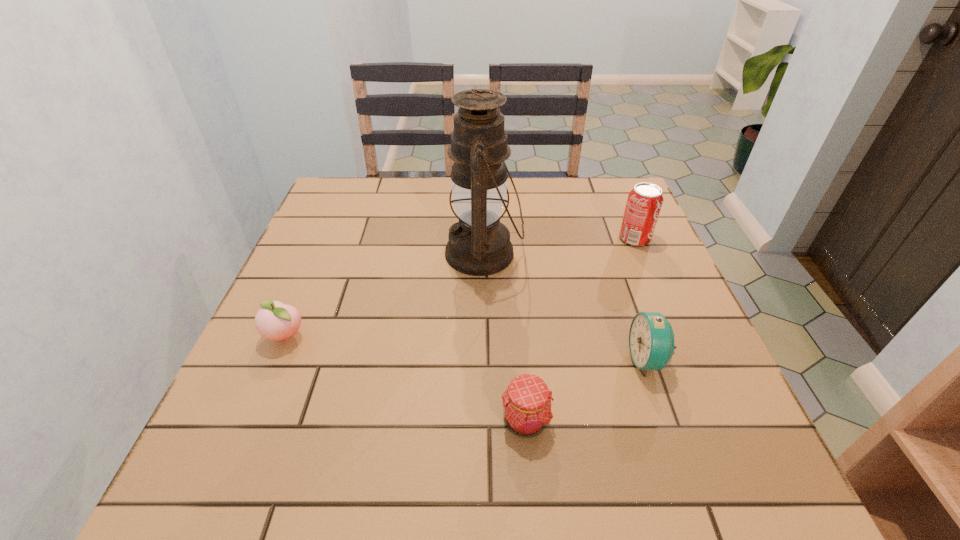
Where is `vacant area situated 0.260m on the front-facing side of the third tallest object`? This screenshot has height=540, width=960. vacant area situated 0.260m on the front-facing side of the third tallest object is located at coordinates (499, 360).

Locate an element on the screen. blank space located 0.060m on the front-facing side of the third tallest object is located at coordinates (600, 360).

Where is `blank space located 0.400m on the right of the peach`? blank space located 0.400m on the right of the peach is located at coordinates (498, 336).

Find the location of a particular element. This screenshot has width=960, height=540. vacant point located 0.110m on the right of the nearest object is located at coordinates (612, 421).

At what (x,y) coordinates should I click in order to perform the action: click on object present at the left edge. Please return your answer as a coordinate pair (x, y). Looking at the image, I should click on (276, 321).

Identify the location of soda can at the right edge. Image resolution: width=960 pixels, height=540 pixels. (645, 200).

Locate an element on the screen. The image size is (960, 540). alarm clock located in the right edge section of the desktop is located at coordinates point(651,339).

You are a GUI agent. You are given a task and a screenshot of the screen. Output one action in this format:
    pyautogui.click(x=<x>, y=<y>)
    Task: Click on the vacant space at the far edge of the desktop
    The height and width of the screenshot is (540, 960).
    Given the screenshot: What is the action you would take?
    pyautogui.click(x=512, y=183)

In order to click on vacant space at the near edge in this screenshot , I will do `click(507, 501)`.

Find the location of `vacant region at the left edge`. vacant region at the left edge is located at coordinates (226, 399).